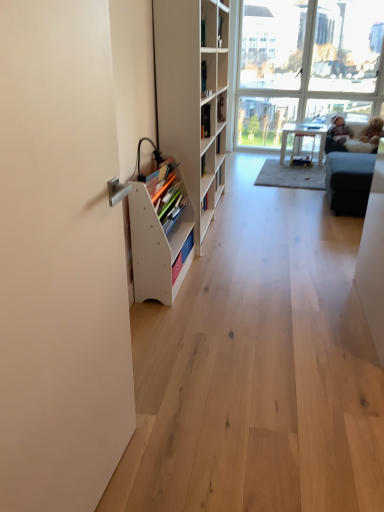
Question: Should I look upward or downward to see white matte screen door at left?

Choices:
 (A) up
 (B) down

Answer: (B)

Question: Is white plastic book at left, arranged as the 1th book when ordered from the bottom, next to white matte screen door at left?

Choices:
 (A) yes
 (B) no

Answer: (B)

Question: Is white plastic book at left, arranged as the 1th book when ordered from the bottom, thinner than white matte screen door at left?

Choices:
 (A) yes
 (B) no

Answer: (B)

Question: Does white plastic book at left, which appears as the 1th book when viewed from the front, turn towards white matte screen door at left?

Choices:
 (A) yes
 (B) no

Answer: (B)

Question: Is white plastic book at left, which ranks as the second book in right-to-left order, wider than white matte screen door at left?

Choices:
 (A) no
 (B) yes

Answer: (B)

Question: Is white plastic book at left, acting as the 1th book starting from the left, positioned before white matte screen door at left?

Choices:
 (A) no
 (B) yes

Answer: (A)

Question: From the image's perspective, is white plastic book at left, which ranks as the second book in right-to-left order, over white matte screen door at left?

Choices:
 (A) yes
 (B) no

Answer: (A)

Question: Is transparent glass window at upper right at the back of dark gray fabric couch at upper right?

Choices:
 (A) no
 (B) yes

Answer: (B)

Question: Does dark gray fabric couch at upper right have a greater width compared to transparent glass window at upper right?

Choices:
 (A) yes
 (B) no

Answer: (A)

Question: Does dark gray fabric couch at upper right have a greater height compared to transparent glass window at upper right?

Choices:
 (A) no
 (B) yes

Answer: (A)

Question: Does dark gray fabric couch at upper right lie behind transparent glass window at upper right?

Choices:
 (A) no
 (B) yes

Answer: (B)

Question: Does dark gray fabric couch at upper right lie in front of transparent glass window at upper right?

Choices:
 (A) yes
 (B) no

Answer: (B)

Question: Can you confirm if dark gray fabric couch at upper right is thinner than transparent glass window at upper right?

Choices:
 (A) yes
 (B) no

Answer: (B)

Question: Does dark gray fabric couch at upper right have a lesser width compared to hardcover book at upper center, the first book from the right?

Choices:
 (A) yes
 (B) no

Answer: (B)